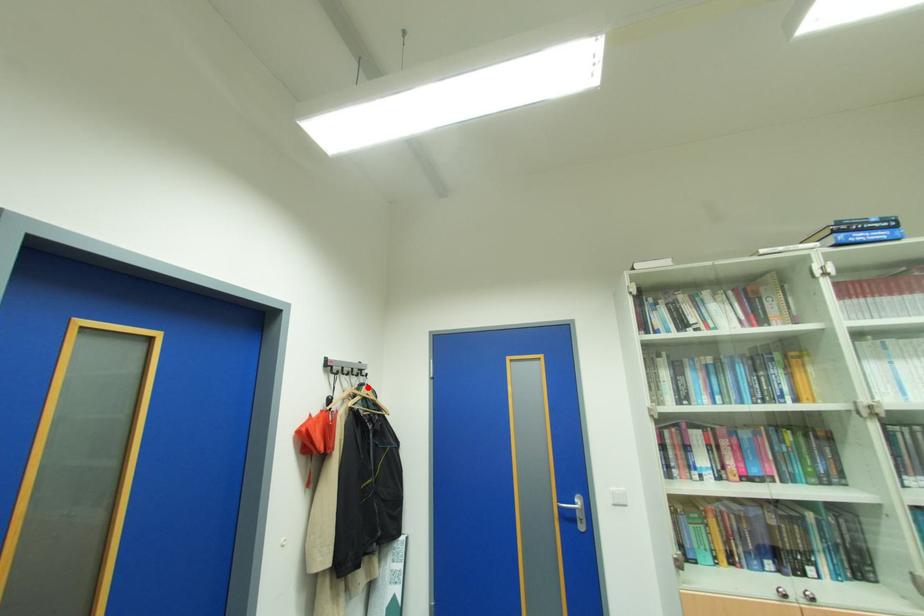
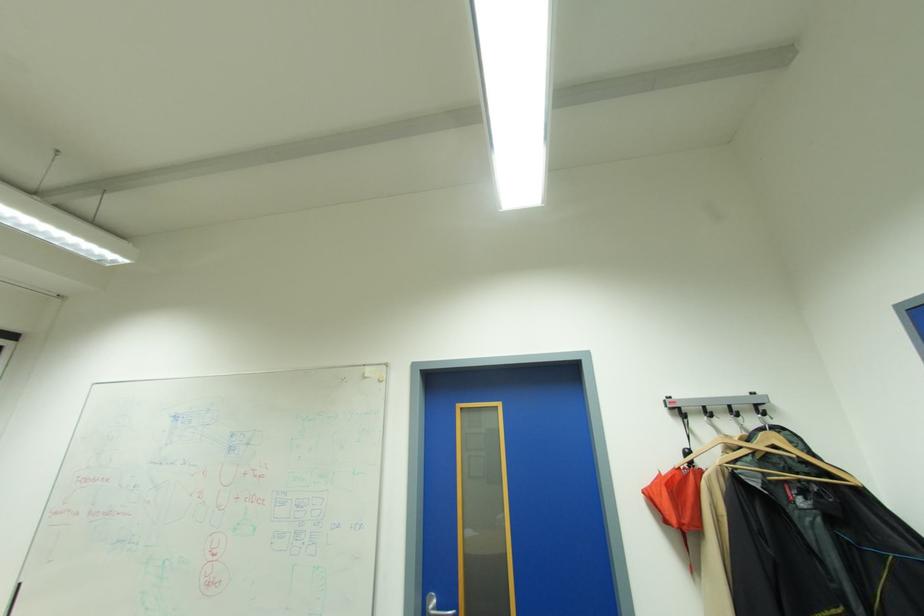
Find the pixel in the second image that matches the highlighted location in the first image.

(764, 434)